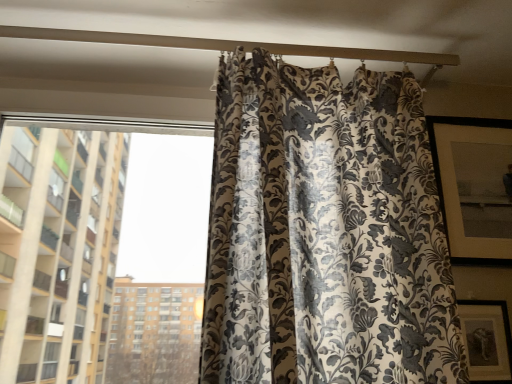
Question: Considering the relative positions of silky floral-patterned curtain at center and white matte beam at upper center in the image provided, is silky floral-patterned curtain at center to the left or to the right of white matte beam at upper center?

Choices:
 (A) right
 (B) left

Answer: (A)

Question: From their relative heights in the image, would you say silky floral-patterned curtain at center is taller or shorter than white matte beam at upper center?

Choices:
 (A) tall
 (B) short

Answer: (A)

Question: Which object is the farthest from the matte black picture frame at lower right?

Choices:
 (A) silky floral curtain at right
 (B) white matte beam at upper center
 (C) silky floral-patterned curtain at center

Answer: (B)

Question: Which is farther from the white matte beam at upper center?

Choices:
 (A) silky floral curtain at right
 (B) matte black picture frame at lower right
 (C) silky floral-patterned curtain at center

Answer: (B)